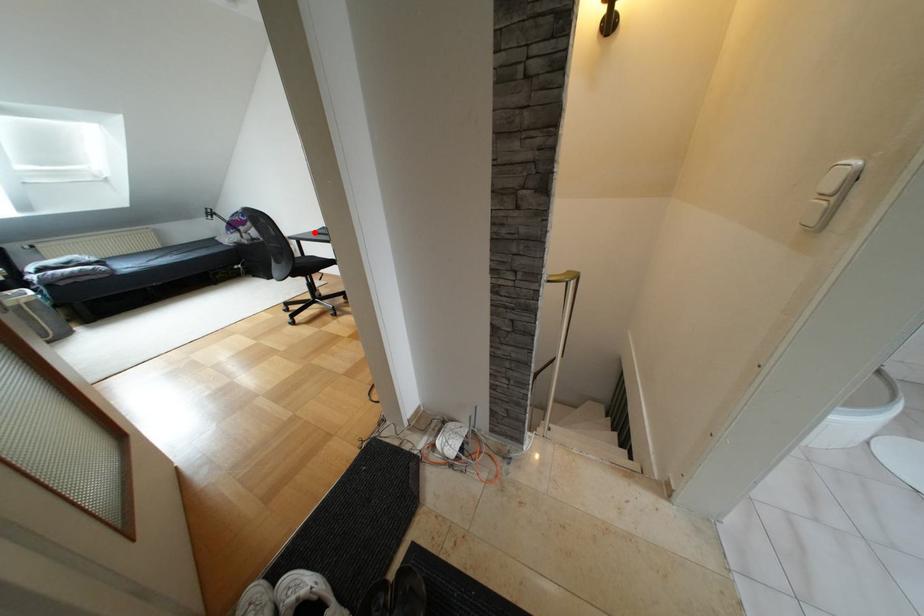
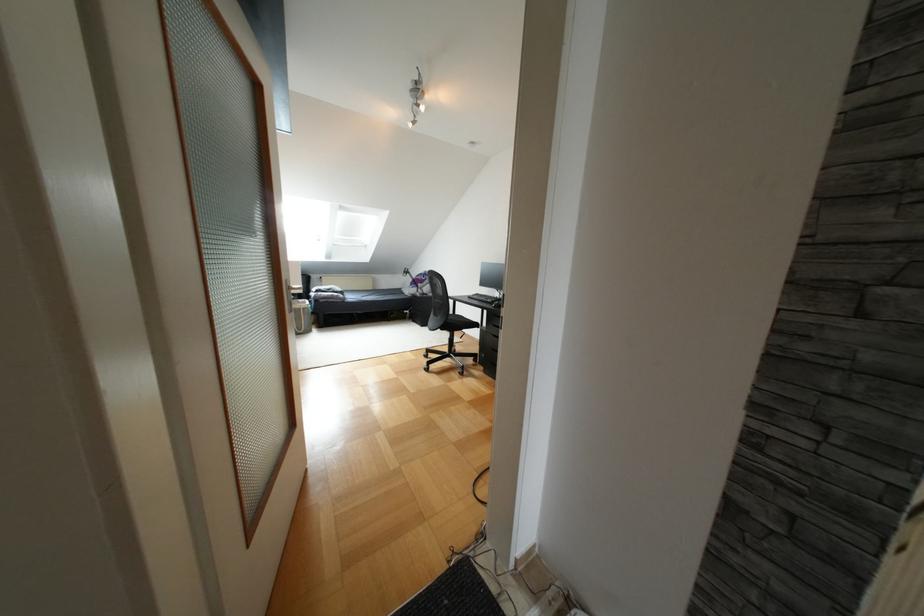
In the second image, find the point that corresponds to the highlighted location in the first image.

(468, 297)